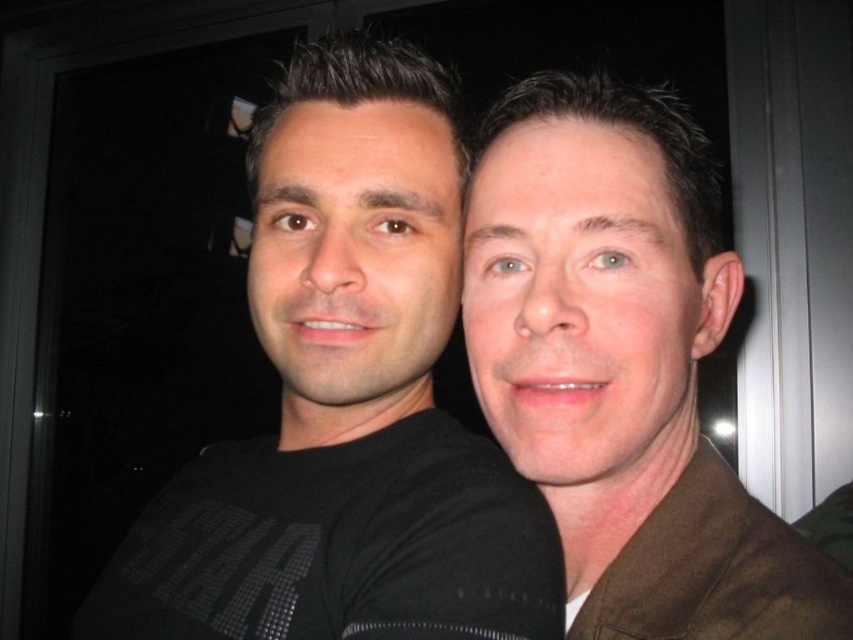
Question: Among these points, which one is nearest to the camera?

Choices:
 (A) (370, 515)
 (B) (685, 355)

Answer: (B)

Question: Is black matte shirt at left to the right of brown matte jacket at right from the viewer's perspective?

Choices:
 (A) no
 (B) yes

Answer: (A)

Question: Is black matte shirt at left thinner than brown matte jacket at right?

Choices:
 (A) yes
 (B) no

Answer: (B)

Question: Which point is closer to the camera taking this photo?

Choices:
 (A) (593, 307)
 (B) (379, 301)

Answer: (A)

Question: Does black matte shirt at left appear over brown matte jacket at right?

Choices:
 (A) no
 (B) yes

Answer: (B)